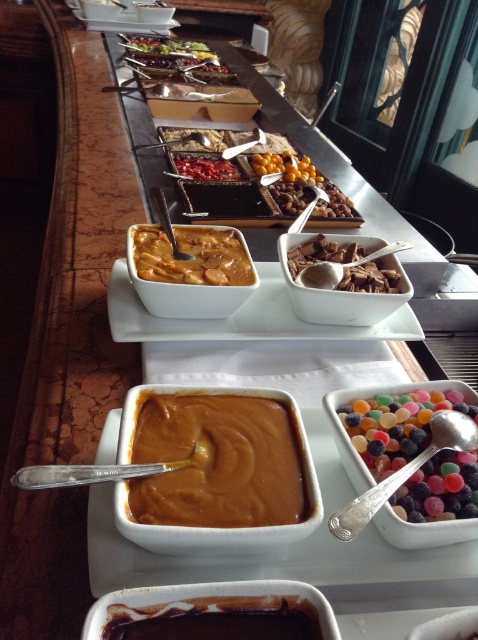
You are a customer at the dessert station and want to grab both the translucent jelly beans at center and the savory meat at center. Which one should you reach for first if you want to pick the item closer to your right hand?

The translucent jelly beans at center is to the right of savory meat at center, so you should reach for the translucent jelly beans at center first if you want the item closer to your right hand.

You are a customer at the dessert station and want to know which dessert is taller between the smooth caramel pudding at center and the translucent jelly beans at center. Can you tell me?

The smooth caramel pudding at center has a greater height compared to the translucent jelly beans at center, so the smooth caramel pudding at center is taller.